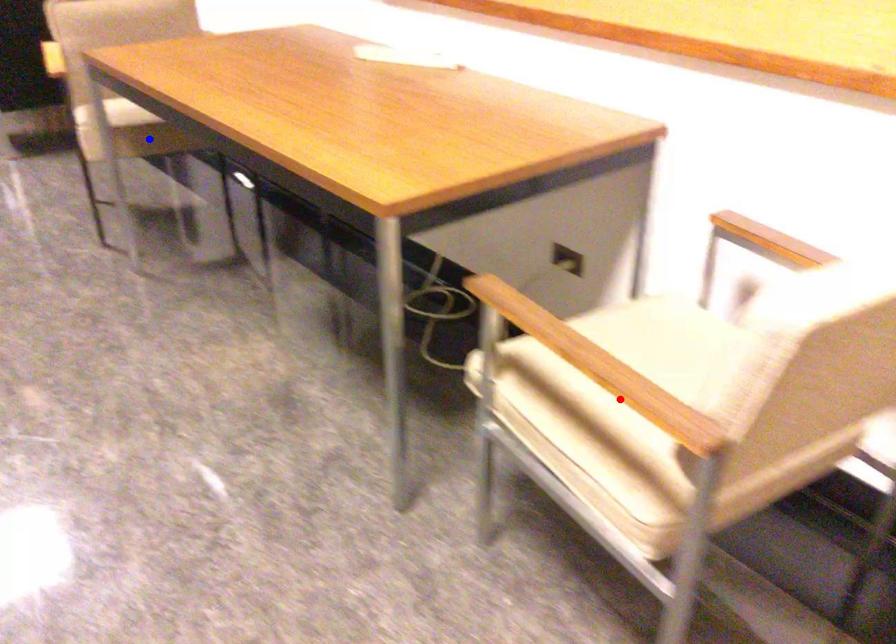
Question: Two points are marked on the image. Which point is closer to the camera?

Choices:
 (A) Blue point is closer.
 (B) Red point is closer.

Answer: (B)